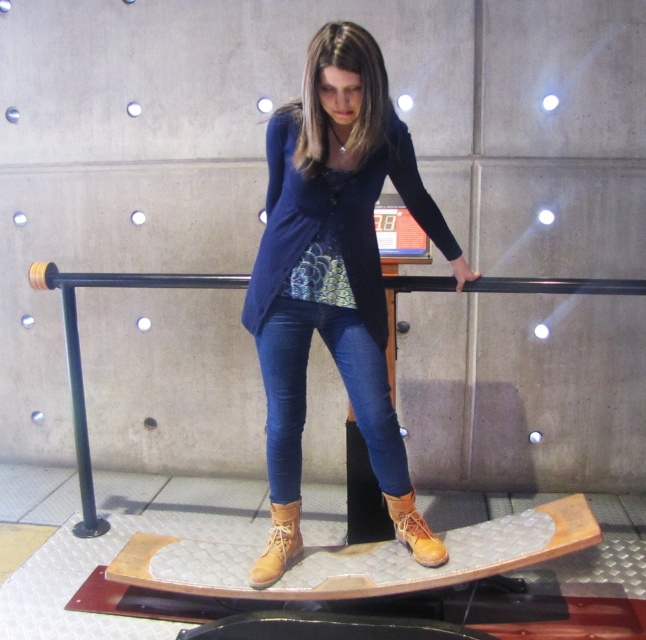
Between matte blue jeans at center and tan suede boot at center, which one appears on the left side from the viewer's perspective?

matte blue jeans at center is more to the left.

Is matte blue jeans at center smaller than tan suede boot at center?

No.

What are the coordinates of `matte blue jeans at center` in the screenshot? It's located at (333, 250).

What do you see at coordinates (304, 392) in the screenshot? The width and height of the screenshot is (646, 640). I see `denim at center` at bounding box center [304, 392].

Can you confirm if denim at center is positioned above black metal rail at center?

Yes.

Between point (275, 497) and point (388, 284), which one is positioned behind?

Point (388, 284)

Where is `denim at center`? The image size is (646, 640). denim at center is located at coordinates (304, 392).

Can you confirm if matte blue jeans at center is positioned above denim at center?

Yes, matte blue jeans at center is above denim at center.

Which is in front, point (306, 312) or point (298, 310)?

Positioned in front is point (298, 310).

Between point (300, 147) and point (355, 324), which one is positioned in front?

Positioned in front is point (300, 147).

At what (x,y) coordinates should I click in order to perform the action: click on matte blue jeans at center. Please return your answer as a coordinate pair (x, y). This screenshot has width=646, height=640. Looking at the image, I should click on (333, 250).